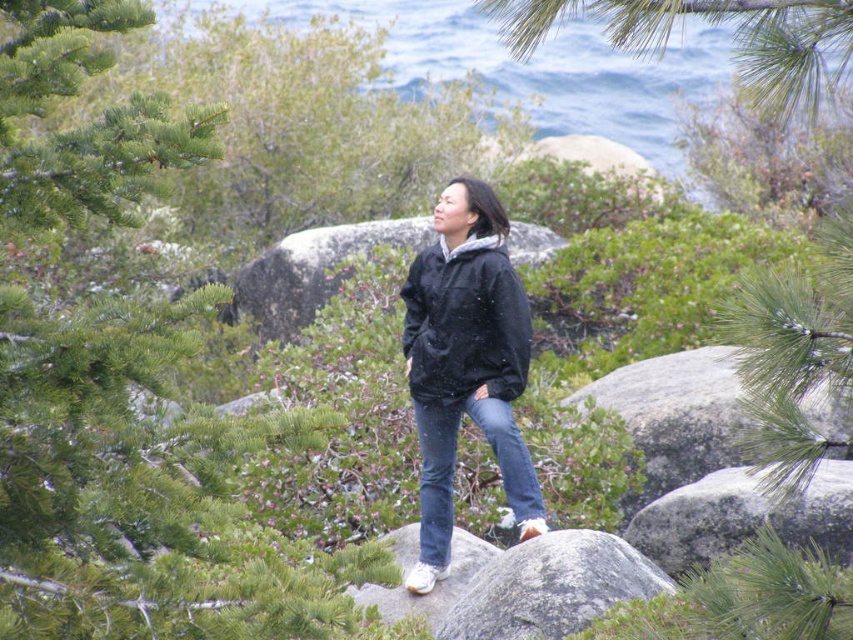
Between black matte jacket at center and gray granite boulder at center-right, which one is positioned lower?

gray granite boulder at center-right

Is point (415, 298) farther from viewer compared to point (693, 477)?

No, it is in front of (693, 477).

This screenshot has height=640, width=853. In order to click on black matte jacket at center in this screenshot , I will do `click(466, 364)`.

Is matte black jacket at center smaller than gray smooth boulder at center?

Yes.

Is matte black jacket at center shorter than gray smooth boulder at center?

In fact, matte black jacket at center may be taller than gray smooth boulder at center.

Does point (496, 292) lie behind point (560, 636)?

That is True.

Locate an element on the screen. Image resolution: width=853 pixels, height=640 pixels. matte black jacket at center is located at coordinates (465, 323).

Can you confirm if green pine branch at upper center is bigger than gray granite boulder at center-right?

Indeed, green pine branch at upper center has a larger size compared to gray granite boulder at center-right.

Is green pine branch at upper center to the left of gray granite boulder at center-right from the viewer's perspective?

In fact, green pine branch at upper center is to the right of gray granite boulder at center-right.

Who is more forward, (712, 16) or (740, 433)?

Point (712, 16)

Where is `green pine branch at upper center`? The image size is (853, 640). green pine branch at upper center is located at coordinates (717, 22).